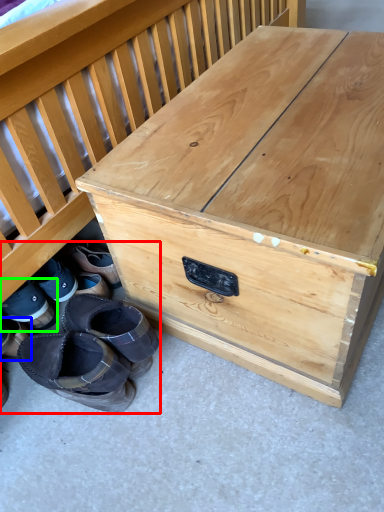
Question: Based on their relative distances, which object is nearer to footwear (highlighted by a red box)? Choose from footwear (highlighted by a blue box) and footwear (highlighted by a green box).

Choices:
 (A) footwear
 (B) footwear

Answer: (B)